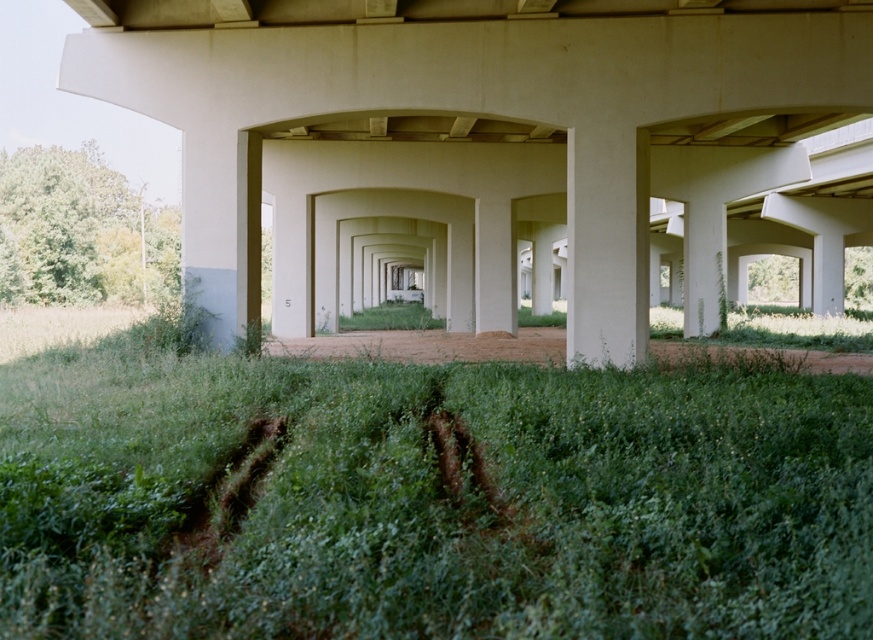
Question: Which object is closer to the camera taking this photo?

Choices:
 (A) dirt/gravel path at center
 (B) white smooth concrete pillar at center
 (C) green grass at center
 (D) smooth concrete overpass at center

Answer: (C)

Question: Does green grass at center appear under white smooth concrete pillar at center?

Choices:
 (A) no
 (B) yes

Answer: (B)

Question: Can you confirm if green grass at center is bigger than dirt/gravel path at center?

Choices:
 (A) yes
 (B) no

Answer: (A)

Question: Which object appears closest to the camera in this image?

Choices:
 (A) dirt/gravel path at center
 (B) white smooth concrete pillar at center
 (C) smooth concrete overpass at center

Answer: (A)

Question: Estimate the real-world distances between objects in this image. Which object is closer to the green grass at center?

Choices:
 (A) white smooth concrete pillar at center
 (B) dirt/gravel path at center

Answer: (A)

Question: Is green grass at center to the left of white smooth concrete pillar at center from the viewer's perspective?

Choices:
 (A) yes
 (B) no

Answer: (A)